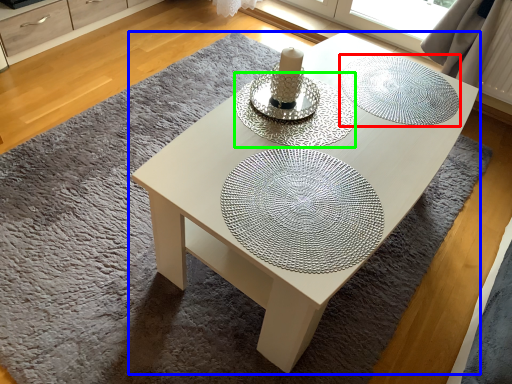
Question: Considering the real-world distances, which object is closest to glass plate (highlighted by a red box)? coffee table (highlighted by a blue box) or glass plate (highlighted by a green box).

Choices:
 (A) coffee table
 (B) glass plate

Answer: (A)